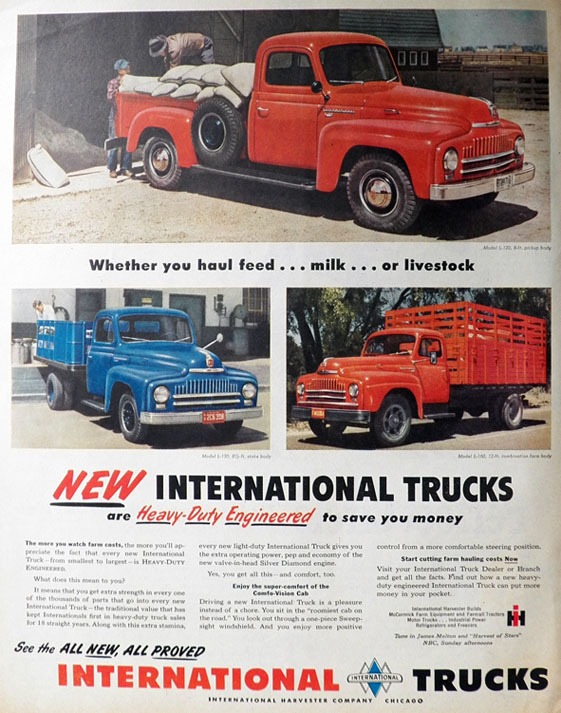
The width and height of the screenshot is (561, 713). Identify the location of hood. (363, 363), (165, 356), (440, 103).